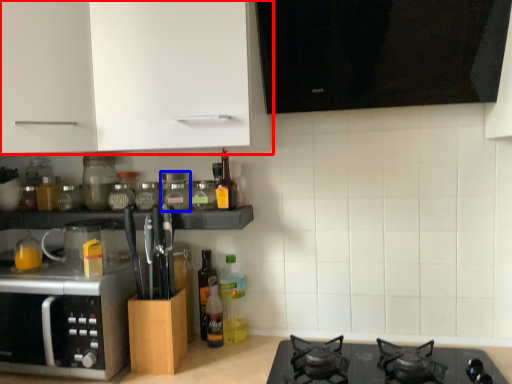
Question: Which object is further to the camera taking this photo, cabinetry (highlighted by a red box) or glass jar (highlighted by a blue box)?

Choices:
 (A) cabinetry
 (B) glass jar

Answer: (B)